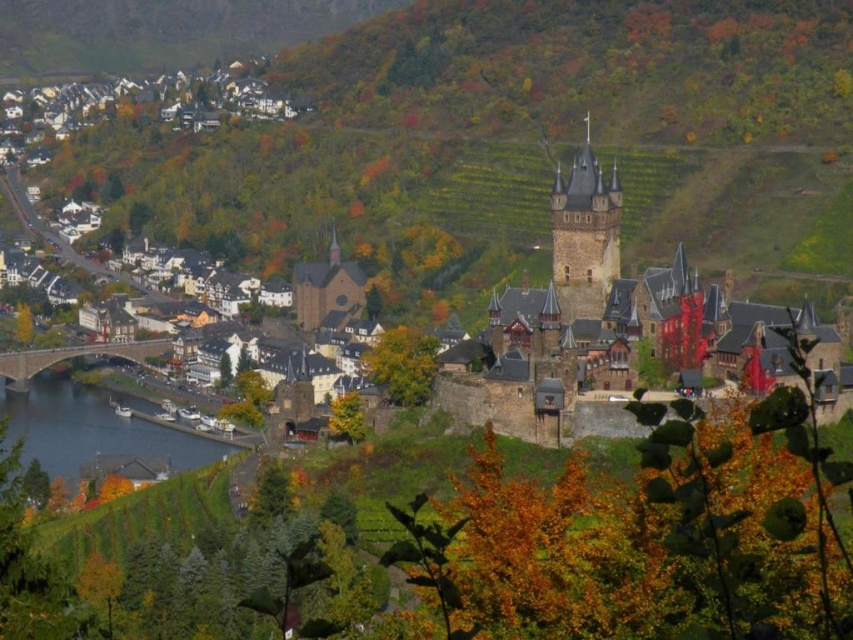
Question: Estimate the real-world distances between objects in this image. Which object is closer to the stone bridge at lower left?

Choices:
 (A) blue water at lower left
 (B) dark brown stone castle at right
 (C) dark brown stone tower at upper right

Answer: (A)

Question: Does dark brown stone tower at upper right have a larger size compared to stone bridge at lower left?

Choices:
 (A) no
 (B) yes

Answer: (B)

Question: In this image, where is blue water at lower left located relative to stone bridge at lower left?

Choices:
 (A) right
 (B) left

Answer: (A)

Question: Does blue water at lower left appear over dark brown stone tower at upper right?

Choices:
 (A) no
 (B) yes

Answer: (A)

Question: Which of the following is the farthest from the observer?

Choices:
 (A) dark brown stone tower at upper right
 (B) blue water at lower left
 (C) dark brown stone castle at right
 (D) stone bridge at lower left

Answer: (D)

Question: Estimate the real-world distances between objects in this image. Which object is closer to the blue water at lower left?

Choices:
 (A) dark brown stone castle at right
 (B) stone bridge at lower left
 (C) dark brown stone tower at upper right

Answer: (B)